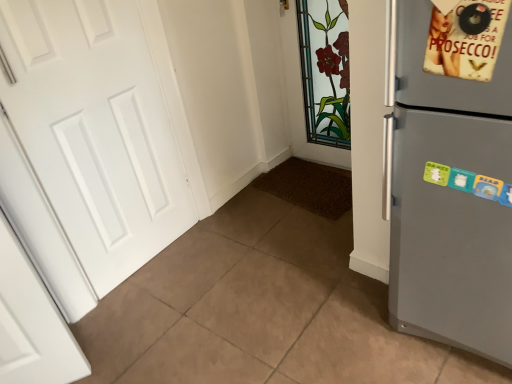
Question: Considering the relative sizes of beige paper poster at upper right and white matte door at left in the image provided, is beige paper poster at upper right taller than white matte door at left?

Choices:
 (A) no
 (B) yes

Answer: (A)

Question: Can you confirm if beige paper poster at upper right is smaller than white matte door at left?

Choices:
 (A) no
 (B) yes

Answer: (B)

Question: From a real-world perspective, is beige paper poster at upper right on top of white matte door at left?

Choices:
 (A) no
 (B) yes

Answer: (B)

Question: From the image's perspective, is beige paper poster at upper right located beneath white matte door at left?

Choices:
 (A) yes
 (B) no

Answer: (B)

Question: Considering the relative sizes of beige paper poster at upper right and white matte door at left in the image provided, is beige paper poster at upper right bigger than white matte door at left?

Choices:
 (A) no
 (B) yes

Answer: (A)

Question: In terms of height, does white matte door at left look taller or shorter compared to beige paper poster at upper right?

Choices:
 (A) short
 (B) tall

Answer: (B)

Question: From the image's perspective, is white matte door at left positioned above or below beige paper poster at upper right?

Choices:
 (A) above
 (B) below

Answer: (B)

Question: Is white matte door at left in front of or behind beige paper poster at upper right in the image?

Choices:
 (A) front
 (B) behind

Answer: (B)

Question: In terms of size, does white matte door at left appear bigger or smaller than beige paper poster at upper right?

Choices:
 (A) big
 (B) small

Answer: (A)

Question: From the image's perspective, is beige paper poster at upper right above or below satin grey fridge at right?

Choices:
 (A) above
 (B) below

Answer: (A)

Question: Considering the positions of beige paper poster at upper right and satin grey fridge at right in the image, is beige paper poster at upper right taller or shorter than satin grey fridge at right?

Choices:
 (A) short
 (B) tall

Answer: (A)

Question: Relative to satin grey fridge at right, is beige paper poster at upper right in front or behind?

Choices:
 (A) behind
 (B) front

Answer: (A)

Question: From a real-world perspective, is beige paper poster at upper right physically located above or below satin grey fridge at right?

Choices:
 (A) above
 (B) below

Answer: (A)

Question: Is satin grey fridge at right in front of or behind beige paper poster at upper right in the image?

Choices:
 (A) front
 (B) behind

Answer: (A)

Question: In terms of size, does satin grey fridge at right appear bigger or smaller than beige paper poster at upper right?

Choices:
 (A) big
 (B) small

Answer: (A)